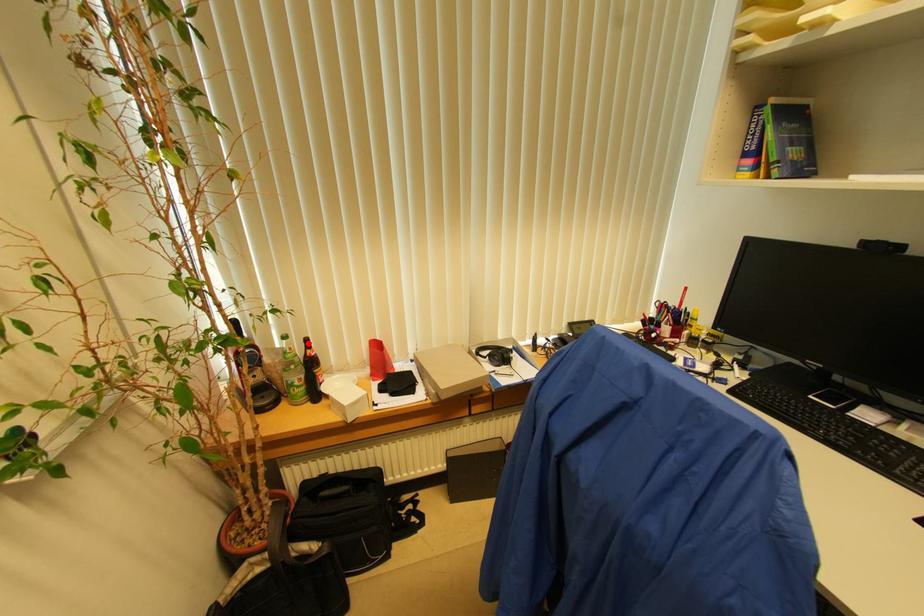
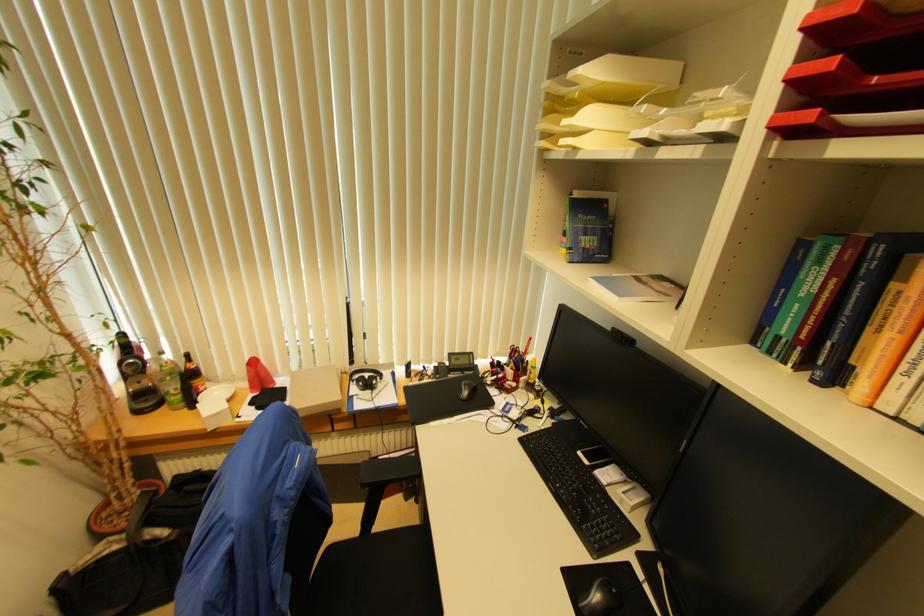
Question: I am providing you with two images of the same scene from different viewpoints. In image1, a red point is highlighted. Considering the same 3D point in image2, which of the following is correct?

Choices:
 (A) It is closer
 (B) It is farther

Answer: (B)